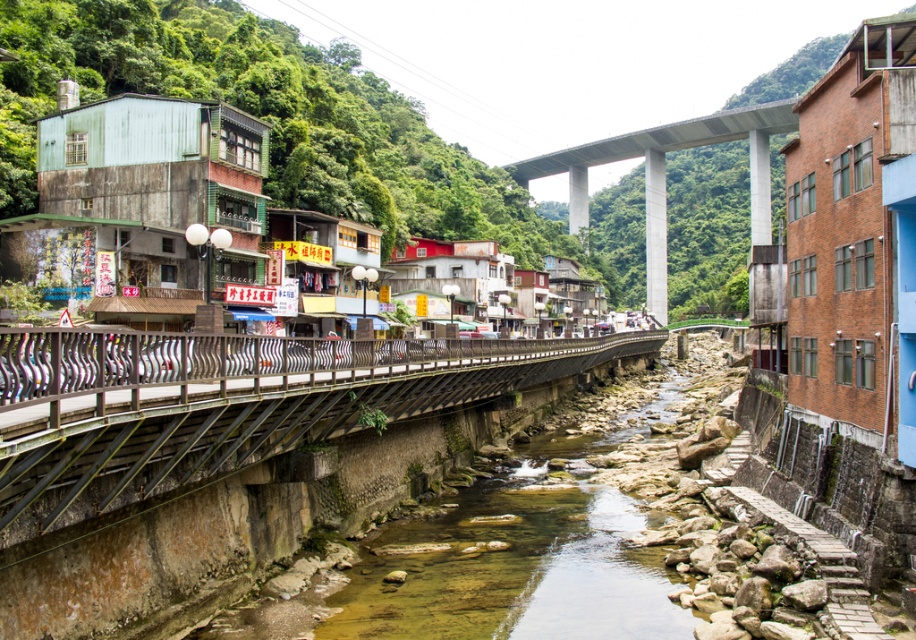
Question: Which point is closer to the camera?

Choices:
 (A) (705, 129)
 (B) (8, 532)

Answer: (B)

Question: Is metallic gray rail at center smaller than concrete bridge at upper center?

Choices:
 (A) yes
 (B) no

Answer: (A)

Question: Is metallic gray rail at center wider than concrete bridge at upper center?

Choices:
 (A) no
 (B) yes

Answer: (A)

Question: Can you confirm if metallic gray rail at center is positioned below concrete bridge at upper center?

Choices:
 (A) no
 (B) yes

Answer: (B)

Question: Which point is farther from the camera taking this photo?

Choices:
 (A) (716, 132)
 (B) (205, 428)

Answer: (A)